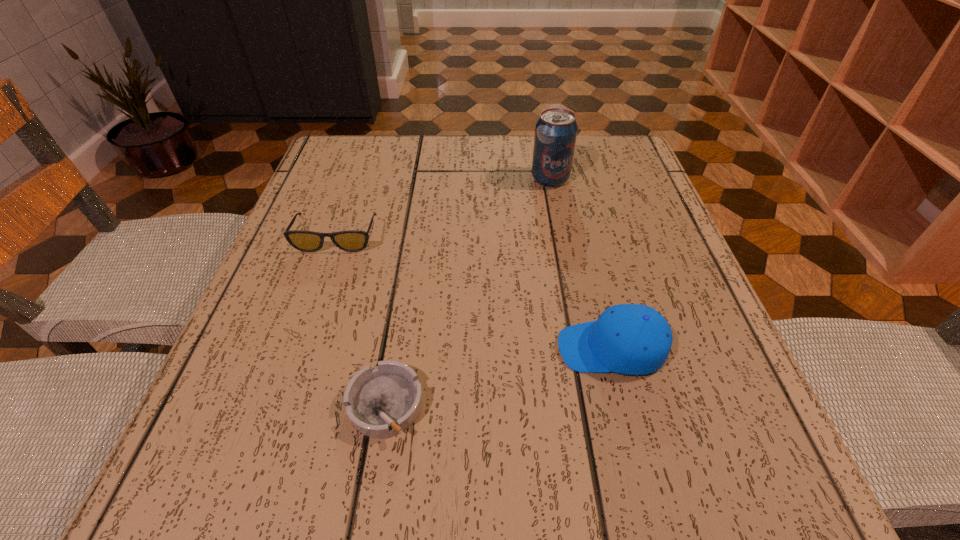
You are a GUI agent. You are given a task and a screenshot of the screen. Output one action in this format:
    pyautogui.click(x=<x>, y=<y>)
    Task: Click on the unoccupied area between the second object from left to right and the second tallest object
    This screenshot has width=960, height=540.
    Given the screenshot: What is the action you would take?
    pyautogui.click(x=498, y=377)

At what (x,y) coordinates should I click in order to perform the action: click on free space between the ashtray and the third tallest object. Please return your answer as a coordinate pair (x, y). This screenshot has height=540, width=960. Looking at the image, I should click on (361, 321).

Identify the location of vacant region between the farthest object and the cap. This screenshot has width=960, height=540. (581, 264).

Image resolution: width=960 pixels, height=540 pixels. Find the location of `free space between the ashtray and the third tallest object`. free space between the ashtray and the third tallest object is located at coordinates (361, 321).

Locate an element on the screen. The image size is (960, 540). vacant space that is in between the second tallest object and the farthest object is located at coordinates (581, 264).

What are the coordinates of `vacant area that lies between the shortest object and the leftmost object` in the screenshot? It's located at (361, 321).

This screenshot has width=960, height=540. I want to click on free space between the third shortest object and the second farthest object, so click(x=474, y=293).

Where is `free area in between the shortest object and the third tallest object`? free area in between the shortest object and the third tallest object is located at coordinates (361, 321).

Locate an element on the screen. free space between the third tallest object and the second tallest object is located at coordinates (474, 293).

Identify the location of unoccupied position between the second farthest object and the second tallest object. (474, 293).